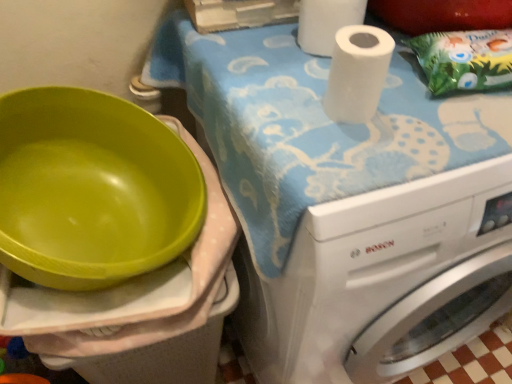
Locate an element on the screen. The width and height of the screenshot is (512, 384). vacant area that is in front of green paper bag at upper right is located at coordinates (459, 135).